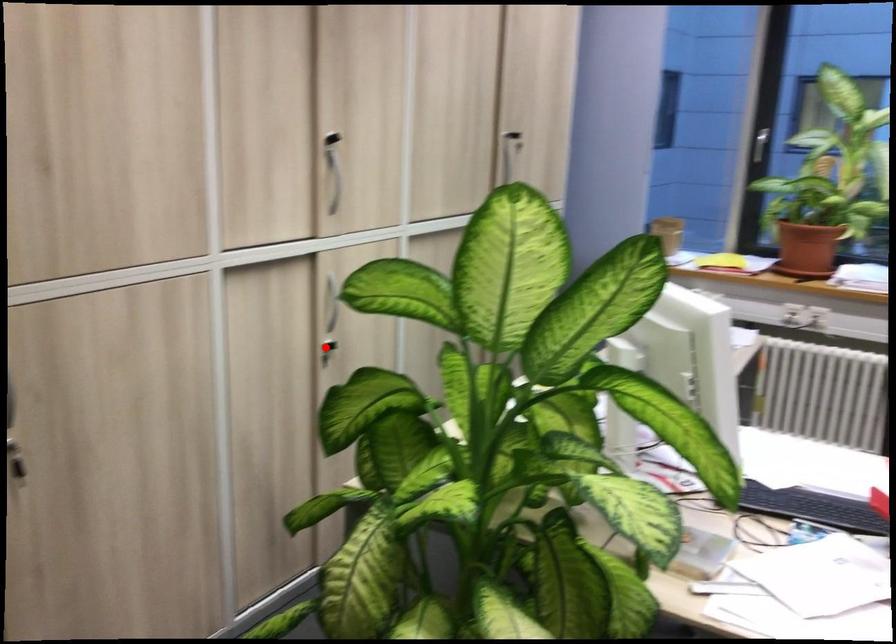
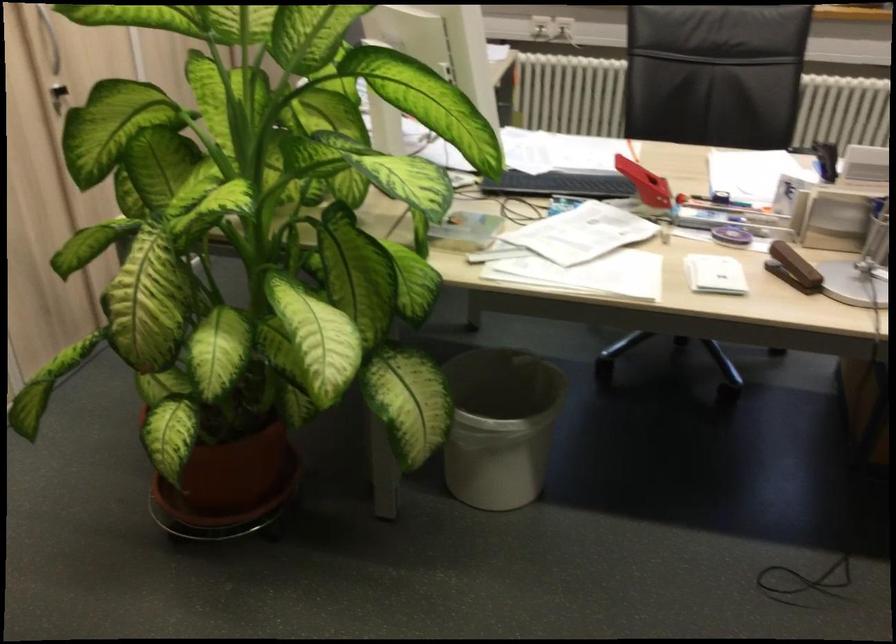
Question: I am providing you with two images of the same scene from different viewpoints. Image1 has a red point marked. In image2, the corresponding 3D location appears at what relative position? Reply with the corresponding letter.

Choices:
 (A) Closer
 (B) Farther

Answer: (A)